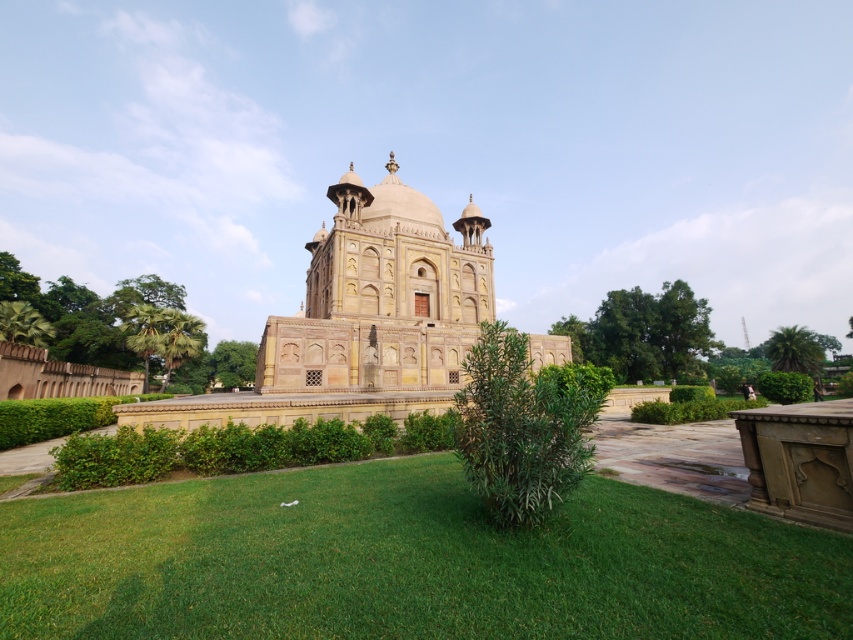
Question: Does green leafy palm tree at lower right have a larger size compared to green leafy tree at center?

Choices:
 (A) no
 (B) yes

Answer: (B)

Question: Which object is positioned closest to the green leafy tree at upper right?

Choices:
 (A) green leafy palm tree at lower right
 (B) green leafy tree at left

Answer: (A)

Question: Is beige stone palace at center smaller than green leafy tree at upper right?

Choices:
 (A) yes
 (B) no

Answer: (B)

Question: Which point is closer to the camera?

Choices:
 (A) (647, 294)
 (B) (9, 337)
 (C) (113, 308)
 (D) (172, 588)

Answer: (D)

Question: Which of the following is the closest to the observer?

Choices:
 (A) (0, 264)
 (B) (345, 596)
 (C) (809, 368)
 (D) (20, 330)

Answer: (B)

Question: Is green leafy tree at upper right to the left of green leafy palm tree at lower right from the viewer's perspective?

Choices:
 (A) no
 (B) yes

Answer: (B)